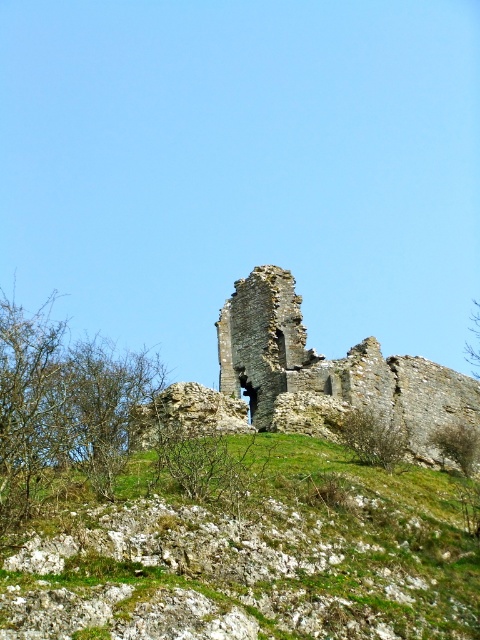
You are standing at the base of the ancient stone structure and want to find the green grassy area. According to the coordinates provided, where should you look to find the green grassy at center?

The green grassy at center is located at coordinates point [248,552].

You are standing on the hill and want to walk towards the rustic stone castle at center. Which direction should you walk from the green grassy at center?

You should walk to the right from the green grassy at center because the green grassy at center is to the left of rustic stone castle at center.